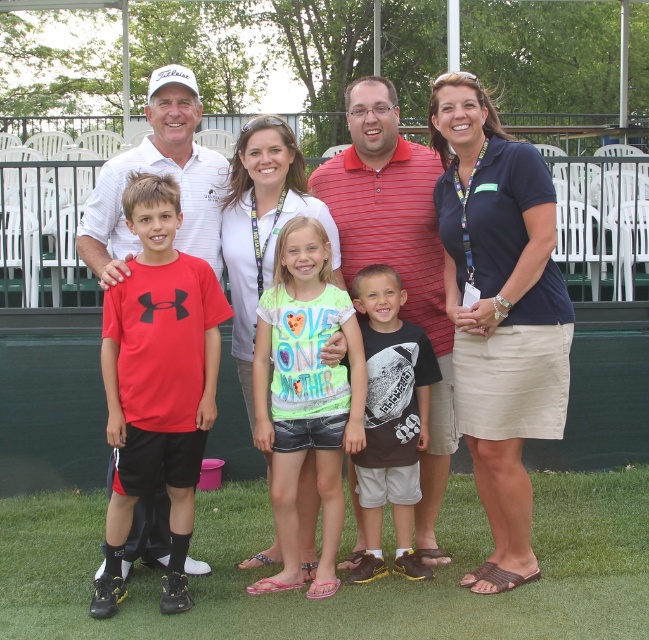
You are standing in front of the golf course scene. There are two points marked in the image. The first point is at coordinate point (286, 332) and the second point is at coordinate point (387, 368). Which point is closer to you?

Point (286, 332) is closer to the viewer than point (387, 368).